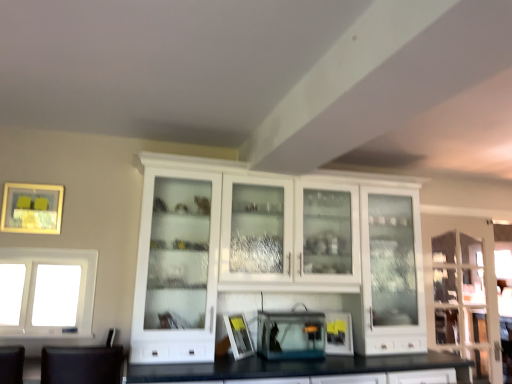
Question: From the image's perspective, is transparent plastic aquarium at center, the 1th appliance when ordered from left to right, beneath clear glass cabinet at right?

Choices:
 (A) no
 (B) yes

Answer: (B)

Question: Does transparent plastic aquarium at center, the 1th appliance when ordered from left to right, have a larger size compared to clear glass cabinet at right?

Choices:
 (A) yes
 (B) no

Answer: (B)

Question: Does transparent plastic aquarium at center, placed as the 2th appliance when sorted from right to left, contain clear glass cabinet at right?

Choices:
 (A) no
 (B) yes

Answer: (A)

Question: From a real-world perspective, is transparent plastic aquarium at center, the 1th appliance when ordered from left to right, positioned under clear glass cabinet at right based on gravity?

Choices:
 (A) yes
 (B) no

Answer: (A)

Question: Does transparent plastic aquarium at center, placed as the 2th appliance when sorted from right to left, come in front of clear glass cabinet at right?

Choices:
 (A) no
 (B) yes

Answer: (B)

Question: Can you confirm if transparent plastic aquarium at center, the 1th appliance when ordered from left to right, is positioned to the right of clear glass cabinet at right?

Choices:
 (A) yes
 (B) no

Answer: (B)

Question: Considering the relative sizes of matte black toaster at center, the 1th appliance in the right-to-left sequence, and white glass window at left in the image provided, is matte black toaster at center, the 1th appliance in the right-to-left sequence, bigger than white glass window at left?

Choices:
 (A) yes
 (B) no

Answer: (B)

Question: Does matte black toaster at center, which ranks as the 2th appliance in left-to-right order, touch white glass window at left?

Choices:
 (A) yes
 (B) no

Answer: (B)

Question: From a real-world perspective, does matte black toaster at center, which ranks as the 2th appliance in left-to-right order, stand above white glass window at left?

Choices:
 (A) no
 (B) yes

Answer: (A)

Question: Considering the relative positions of matte black toaster at center, the 1th appliance in the right-to-left sequence, and white glass window at left in the image provided, is matte black toaster at center, the 1th appliance in the right-to-left sequence, in front of white glass window at left?

Choices:
 (A) no
 (B) yes

Answer: (A)

Question: Is matte black toaster at center, the 1th appliance in the right-to-left sequence, facing towards white glass window at left?

Choices:
 (A) no
 (B) yes

Answer: (A)

Question: Is matte black toaster at center, the 1th appliance in the right-to-left sequence, further to the viewer compared to white glass window at left?

Choices:
 (A) yes
 (B) no

Answer: (A)

Question: Does transparent plastic aquarium at center, placed as the 2th appliance when sorted from right to left, have a lesser width compared to white glass cabinet at center?

Choices:
 (A) yes
 (B) no

Answer: (A)